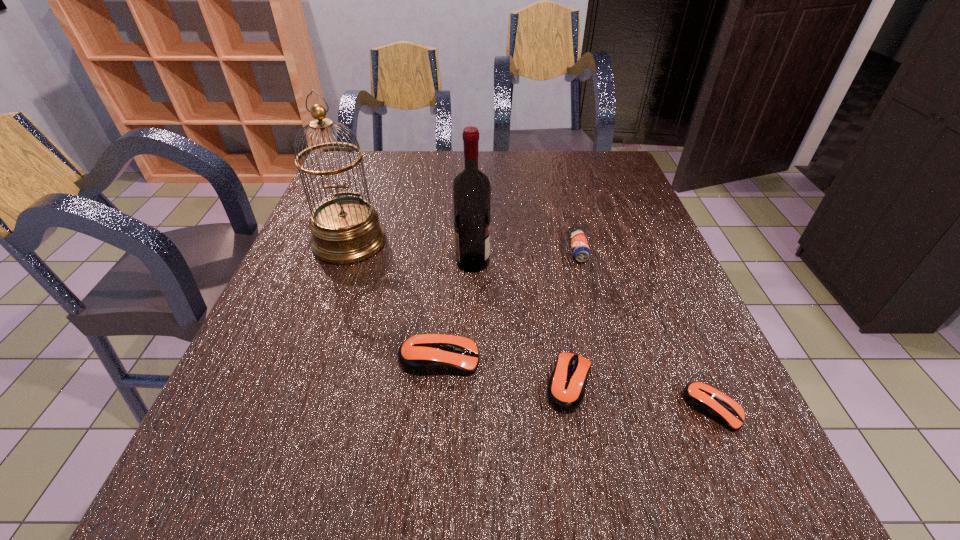
You are a GUI agent. You are given a task and a screenshot of the screen. Output one action in this format:
    pyautogui.click(x=<x>, y=<y>)
    Task: Click on the vacant spot to place a computer mouse on the left
    The height and width of the screenshot is (540, 960).
    Given the screenshot: What is the action you would take?
    pyautogui.click(x=320, y=338)